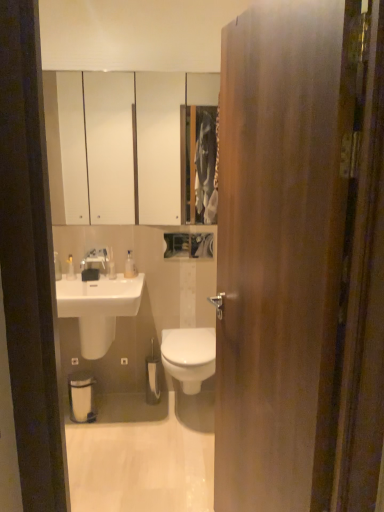
At what (x,y) coordinates should I click in order to perform the action: click on free space above white glossy floor at center (from a real-world perspective). Please return your answer as a coordinate pair (x, y). Image resolution: width=384 pixels, height=512 pixels. Looking at the image, I should click on (139, 441).